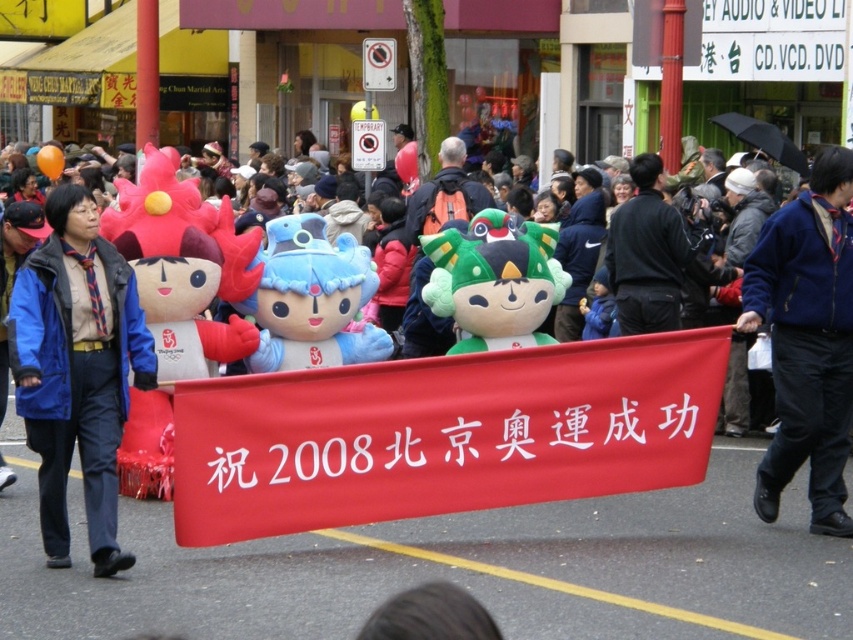
From the picture: You are a photographer standing in the middle of the street. You see a blue fleece jacket at center and a blue plush toy at center. Which one is closer to your right side?

The blue fleece jacket at center is to the right of the blue plush toy at center, so the blue fleece jacket at center is closer to your right side.

Consider the image. You are standing at the center of the street and want to hand out a gift to either the red fabric banner at center or the blue plush toy at center. Which one is closer to you?

The red fabric banner at center is closer to you since it is only 10.58 feet away from the blue plush toy at center, which is farther away.

You are a photographer standing in the middle of the street during the parade. You want to take a photo of both the fluffy plush toy at center and the green plush toy at center. Which one should you adjust your camera angle to focus on first if you want to capture them from left to right in the order they appear?

You should focus on the fluffy plush toy at center first because it is positioned to the left of the green plush toy at center, so capturing them from left to right would start with the fluffy plush toy at center.